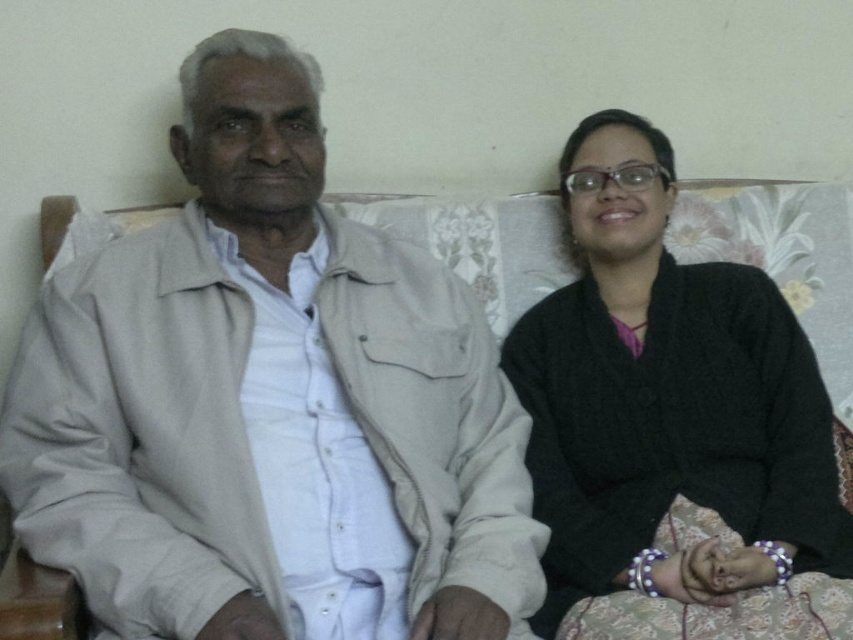
Who is higher up, light beige jacket at left or black knitted sweater at right?

Positioned higher is light beige jacket at left.

Find the location of a particular element. light beige jacket at left is located at coordinates (270, 404).

Is point (326, 522) less distant than point (567, 608)?

Yes, point (326, 522) is in front of point (567, 608).

I want to click on light beige jacket at left, so click(x=270, y=404).